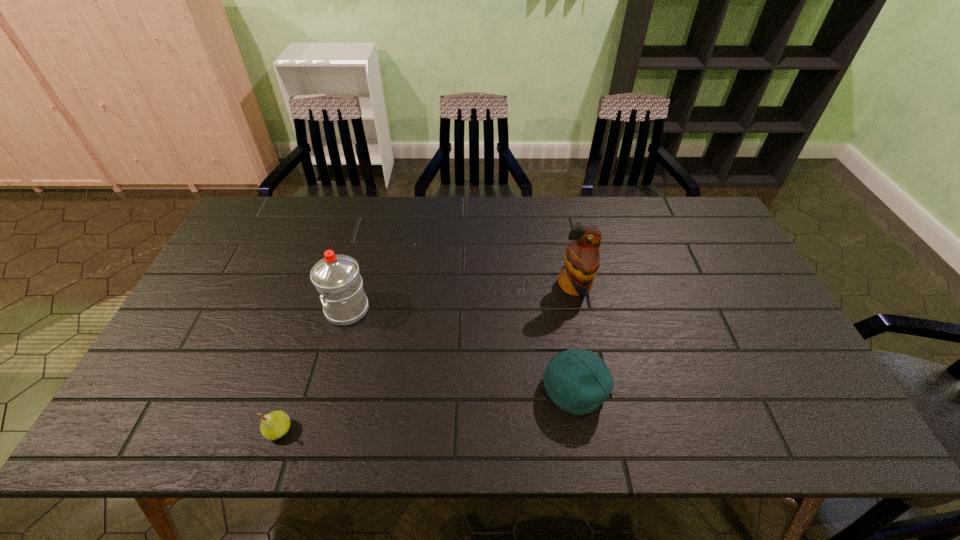
Locate an element on the screen. vacant area between the beanie and the shortest object is located at coordinates (426, 409).

Find the location of `free spot between the water bottle and the parrot`. free spot between the water bottle and the parrot is located at coordinates (461, 298).

Locate an element on the screen. The image size is (960, 540). vacant space in between the parrot and the water bottle is located at coordinates (461, 298).

I want to click on unoccupied area between the parrot and the beanie, so click(574, 338).

This screenshot has width=960, height=540. In order to click on free space that is in between the parrot and the shortest object in this screenshot , I will do `click(427, 358)`.

At what (x,y) coordinates should I click in order to perform the action: click on free space between the beanie and the shortest object. Please return your answer as a coordinate pair (x, y). The width and height of the screenshot is (960, 540). Looking at the image, I should click on click(x=426, y=409).

Identify the location of free space between the parrot and the water bottle. (461, 298).

Where is `object that is the third closest one to the shortest object`? This screenshot has width=960, height=540. object that is the third closest one to the shortest object is located at coordinates (582, 259).

Locate an element on the screen. The width and height of the screenshot is (960, 540). the closest object to the parrot is located at coordinates (578, 381).

At what (x,y) coordinates should I click in order to perform the action: click on free space in the image that satisfies the following two spatial constraints: 1. on the face of the parrot; 2. on the handle side of the water bottle. Please return your answer as a coordinate pair (x, y). Image resolution: width=960 pixels, height=540 pixels. Looking at the image, I should click on (580, 309).